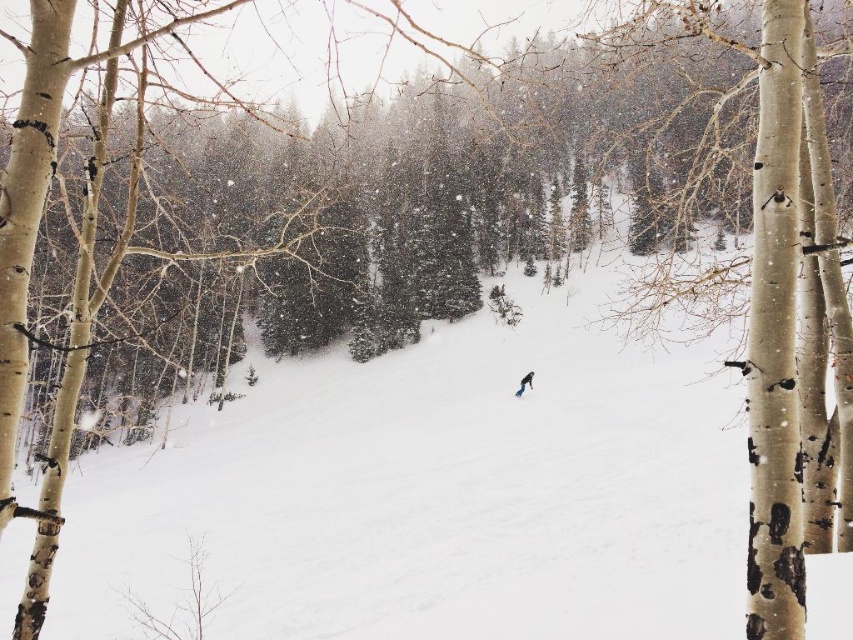
Question: Can you confirm if blue matte snowboard at center is positioned above blue metallic ski at center?

Choices:
 (A) no
 (B) yes

Answer: (B)

Question: Is blue matte snowboard at center to the right of blue metallic ski at center from the viewer's perspective?

Choices:
 (A) no
 (B) yes

Answer: (B)

Question: Can you confirm if blue matte snowboard at center is positioned below blue metallic ski at center?

Choices:
 (A) yes
 (B) no

Answer: (B)

Question: Which point is closer to the camera?

Choices:
 (A) blue matte snowboard at center
 (B) blue metallic ski at center

Answer: (B)

Question: Which point is farther to the camera?

Choices:
 (A) (517, 396)
 (B) (529, 387)

Answer: (B)

Question: Which point appears closest to the camera in this image?

Choices:
 (A) (531, 381)
 (B) (517, 394)

Answer: (B)